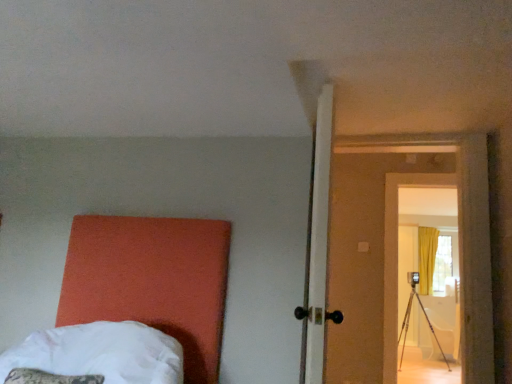
Question: From their relative heights in the image, would you say wooden door at center-right is taller or shorter than white soft bed at lower left?

Choices:
 (A) tall
 (B) short

Answer: (A)

Question: From a real-world perspective, is wooden door at center-right above or below white soft bed at lower left?

Choices:
 (A) above
 (B) below

Answer: (A)

Question: In terms of size, does wooden door at center-right appear bigger or smaller than white soft bed at lower left?

Choices:
 (A) small
 (B) big

Answer: (B)

Question: From a real-world perspective, relative to wooden door at center-right, is white soft bed at lower left vertically above or below?

Choices:
 (A) above
 (B) below

Answer: (B)

Question: Based on their sizes in the image, would you say white soft bed at lower left is bigger or smaller than wooden door at center-right?

Choices:
 (A) big
 (B) small

Answer: (B)

Question: Considering the positions of white soft bed at lower left and wooden door at center-right in the image, is white soft bed at lower left wider or thinner than wooden door at center-right?

Choices:
 (A) thin
 (B) wide

Answer: (B)

Question: Visually, is white soft bed at lower left positioned to the left or to the right of wooden door at center-right?

Choices:
 (A) right
 (B) left

Answer: (B)